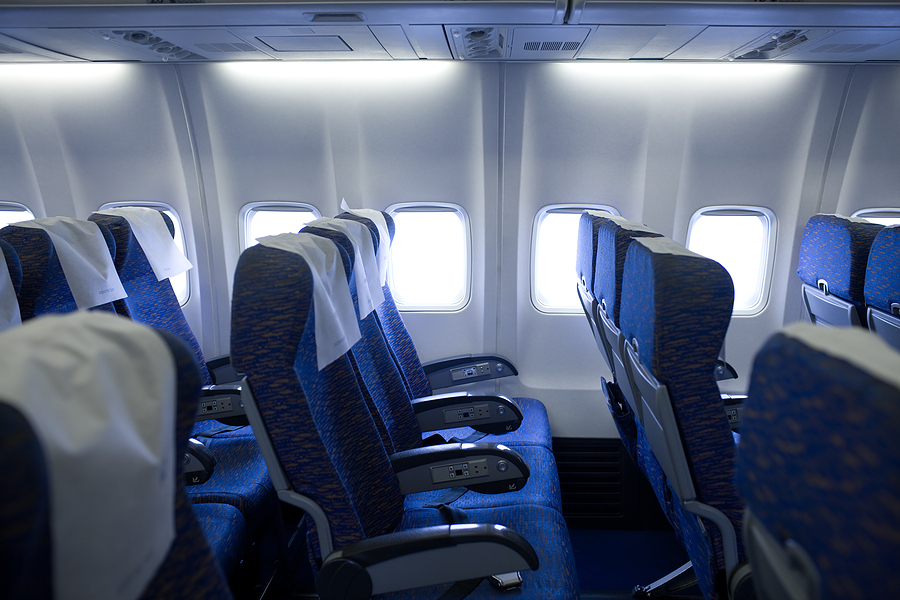
Where is `wall panels`? Image resolution: width=900 pixels, height=600 pixels. wall panels is located at coordinates (878, 170), (688, 123), (138, 157), (423, 136).